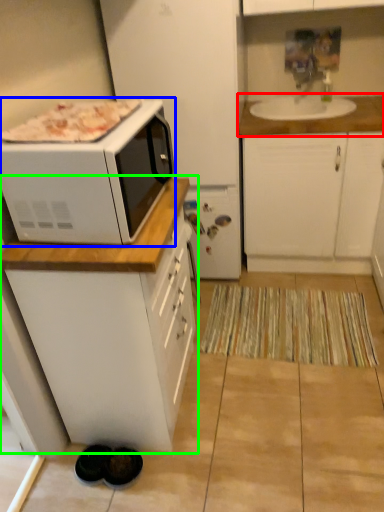
Question: Which is nearer to the countertop (highlighted by a red box)? microwave oven (highlighted by a blue box) or cabinetry (highlighted by a green box).

Choices:
 (A) microwave oven
 (B) cabinetry

Answer: (A)